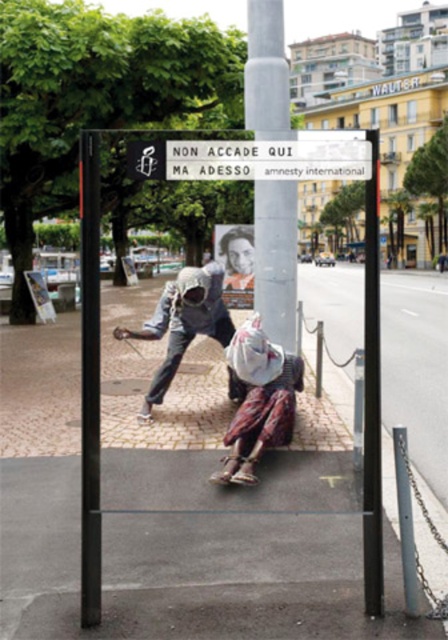
Question: Does white paper poster at center appear under silver metallic helmet at center?

Choices:
 (A) yes
 (B) no

Answer: (B)

Question: Based on their relative distances, which object is farther from the black metal pole at center?

Choices:
 (A) silver metallic helmet at center
 (B) rustic fabric bag at lower center
 (C) concrete pole at center
 (D) white paper sign at upper center

Answer: (A)

Question: Which of the following is the farthest from the observer?

Choices:
 (A) concrete pole at center
 (B) silver metallic helmet at center
 (C) black metal pole at center

Answer: (A)

Question: Is white paper sign at upper center smaller than smooth skin portrait at center?

Choices:
 (A) no
 (B) yes

Answer: (B)

Question: Which of the following is the closest to the observer?

Choices:
 (A) concrete pole at center
 (B) rustic fabric bag at lower center

Answer: (B)

Question: Considering the relative positions of rustic fabric bag at lower center and white paper sign at upper center in the image provided, where is rustic fabric bag at lower center located with respect to white paper sign at upper center?

Choices:
 (A) left
 (B) right

Answer: (A)